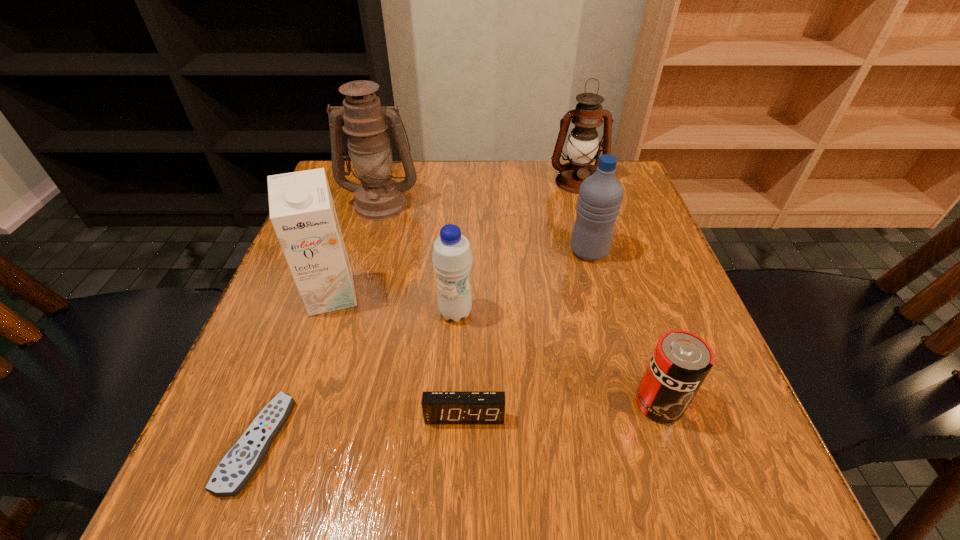
The image size is (960, 540). I want to click on vacant space located 0.150m on the side of the lantern, there is a wick adjustment knob, so click(x=591, y=231).

Image resolution: width=960 pixels, height=540 pixels. In order to click on free spot located 0.220m on the front of the carton in this screenshot , I will do `click(287, 429)`.

The width and height of the screenshot is (960, 540). What are the coordinates of `free space located 0.050m on the back of the farther water bottle` in the screenshot? It's located at click(582, 225).

At what (x,y) coordinates should I click in order to perform the action: click on free space located 0.390m on the back of the nearer water bottle. Please return your answer as a coordinate pair (x, y). Looking at the image, I should click on [x=462, y=187].

Where is `free space located on the left of the can`? The width and height of the screenshot is (960, 540). free space located on the left of the can is located at coordinates (571, 403).

Locate an element on the screen. vacant space located on the front-facing side of the alarm clock is located at coordinates (462, 495).

Find the location of `vacant space located on the right of the shortest object`. vacant space located on the right of the shortest object is located at coordinates (512, 443).

What are the coordinates of `oil lamp situated at the far edge` in the screenshot? It's located at (378, 197).

This screenshot has width=960, height=540. What are the coordinates of `lantern that is at the far edge` in the screenshot? It's located at (583, 143).

In order to click on object at the near edge in this screenshot , I will do `click(238, 466)`.